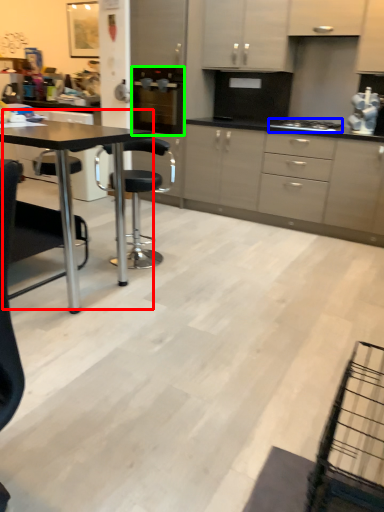
Question: Estimate the real-world distances between objects in this image. Which object is closer to table (highlighted by a red box), gas stove (highlighted by a blue box) or kitchen appliance (highlighted by a green box)?

Choices:
 (A) gas stove
 (B) kitchen appliance

Answer: (B)